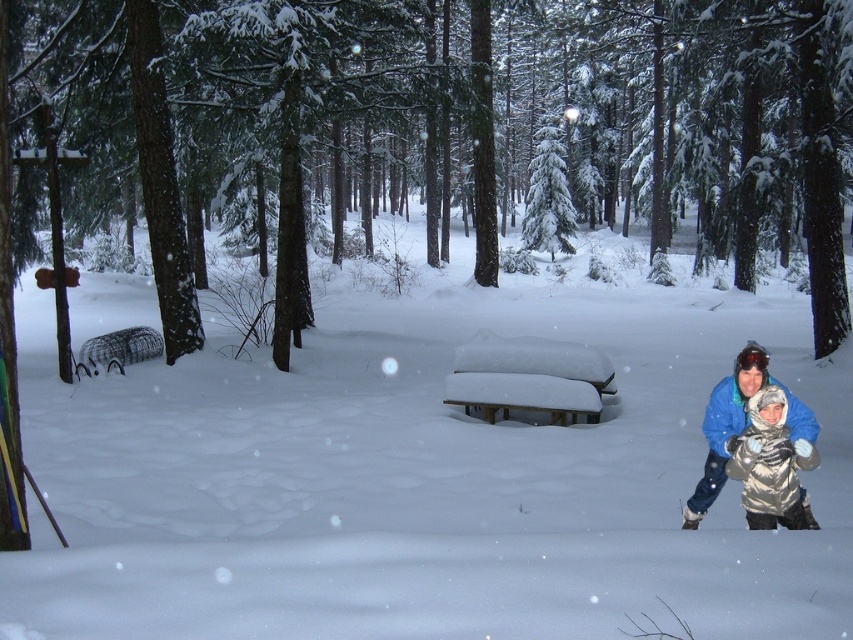
Question: Which object is the closest to the snow-covered wood picnic table at center?

Choices:
 (A) white fluffy snow at center
 (B) brown textured log at center

Answer: (A)

Question: In this image, where is white fluffy snow at center located relative to silver metallic jacket at lower right?

Choices:
 (A) above
 (B) below

Answer: (A)

Question: Can you confirm if white fluffy snow at center is positioned above silver metallic jacket at lower right?

Choices:
 (A) no
 (B) yes

Answer: (B)

Question: Which object is closer to the camera taking this photo?

Choices:
 (A) brown textured log at center
 (B) snow-covered wood picnic table at center
 (C) white fluffy snow at center
 (D) silver metallic jacket at lower right

Answer: (C)

Question: Does brown textured log at center appear under snow-covered wood picnic table at center?

Choices:
 (A) no
 (B) yes

Answer: (A)

Question: Which point is closer to the camera taking this photo?

Choices:
 (A) (577, 369)
 (B) (300, 68)
 (C) (749, 499)
 (D) (361, 572)

Answer: (D)